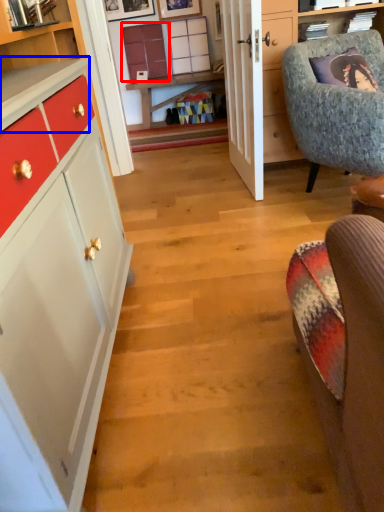
Question: Which of the following is the farthest to the observer, cabinetry (highlighted by a red box) or counter top (highlighted by a blue box)?

Choices:
 (A) cabinetry
 (B) counter top

Answer: (A)